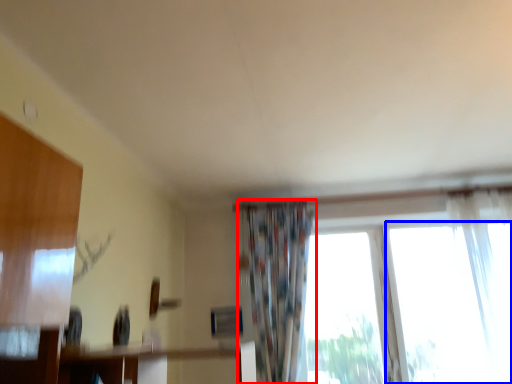
Question: Which point is further to the camera, curtain (highlighted by a red box) or window (highlighted by a blue box)?

Choices:
 (A) curtain
 (B) window

Answer: (B)